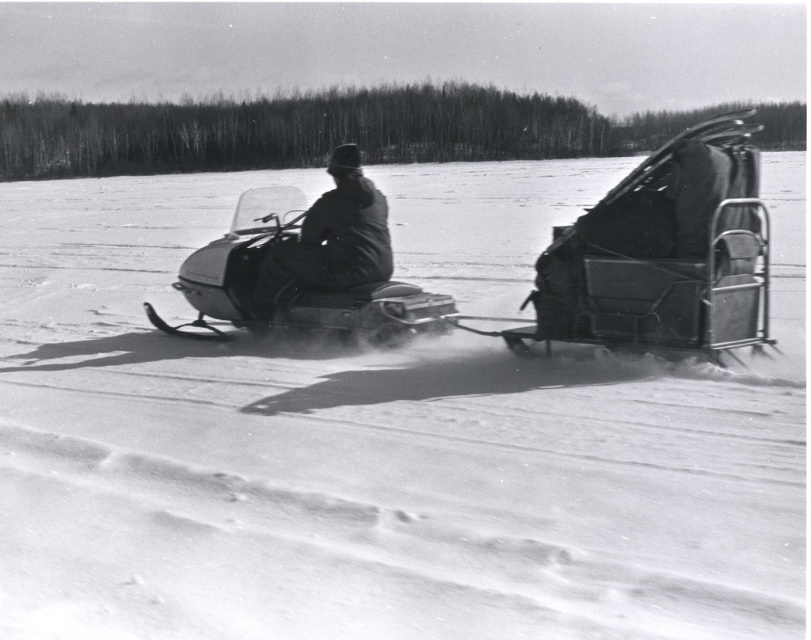
You are standing in the snowy landscape and want to determine which of the two points, point (260, 208) or point (325, 276), is closer to you. Based on the image, which point is nearer?

Point (260, 208) is further to the viewer than point (325, 276), so the closer point to you is point (325, 276).